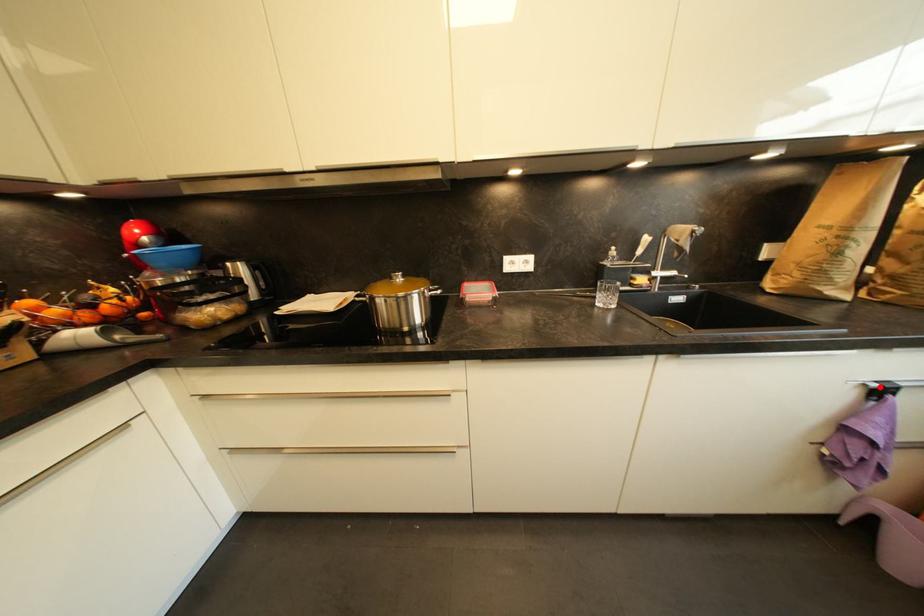
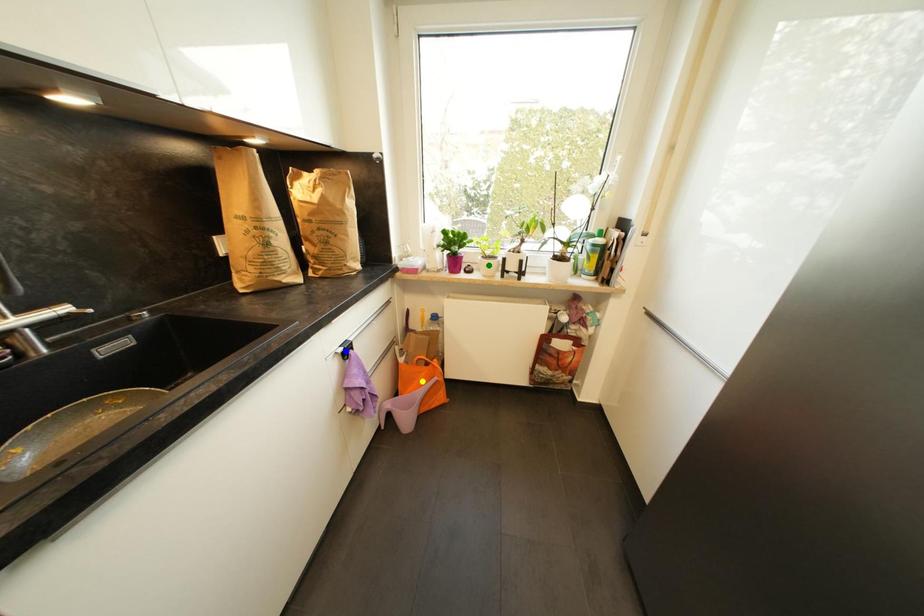
Question: I am providing you with two images of the same scene from different viewpoints. A red point is marked on the first image. You are given multiple points on the second image. In image 2, which mark is for the same physical point as the one in image 1?

Choices:
 (A) yellow point
 (B) green point
 (C) blue point

Answer: (C)